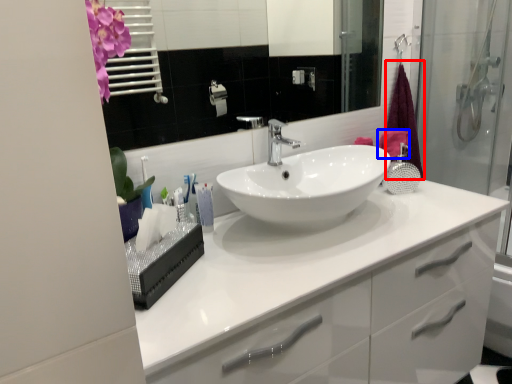
Question: Which of the following is the farthest to the observer, shower curtain (highlighted by a red box) or bath towel (highlighted by a blue box)?

Choices:
 (A) shower curtain
 (B) bath towel

Answer: (A)